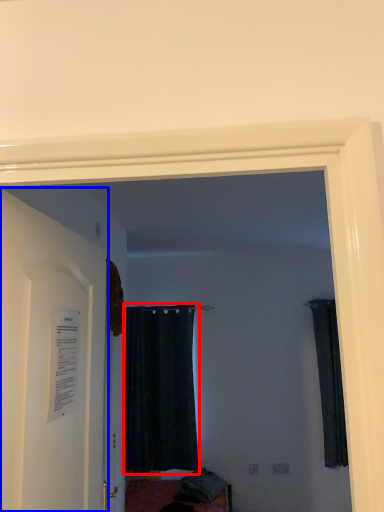
Question: Which point is closer to the camera, curtain (highlighted by a red box) or door (highlighted by a blue box)?

Choices:
 (A) curtain
 (B) door

Answer: (B)